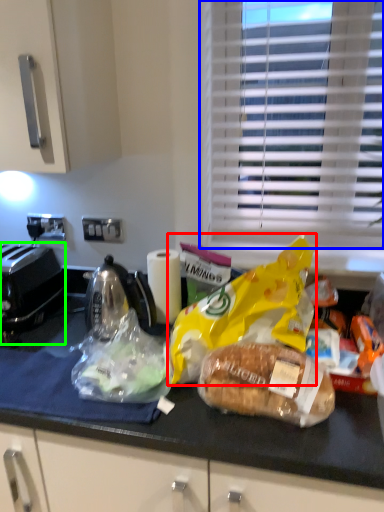
Question: Estimate the real-world distances between objects in this image. Which object is farther from plastic bag (highlighted by a red box), window blind (highlighted by a blue box) or toaster (highlighted by a green box)?

Choices:
 (A) window blind
 (B) toaster

Answer: (B)